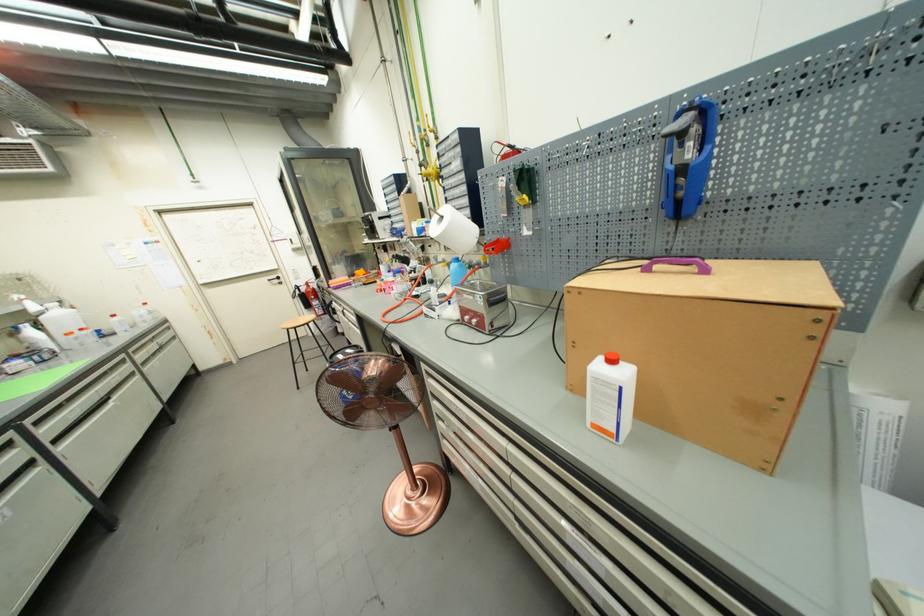
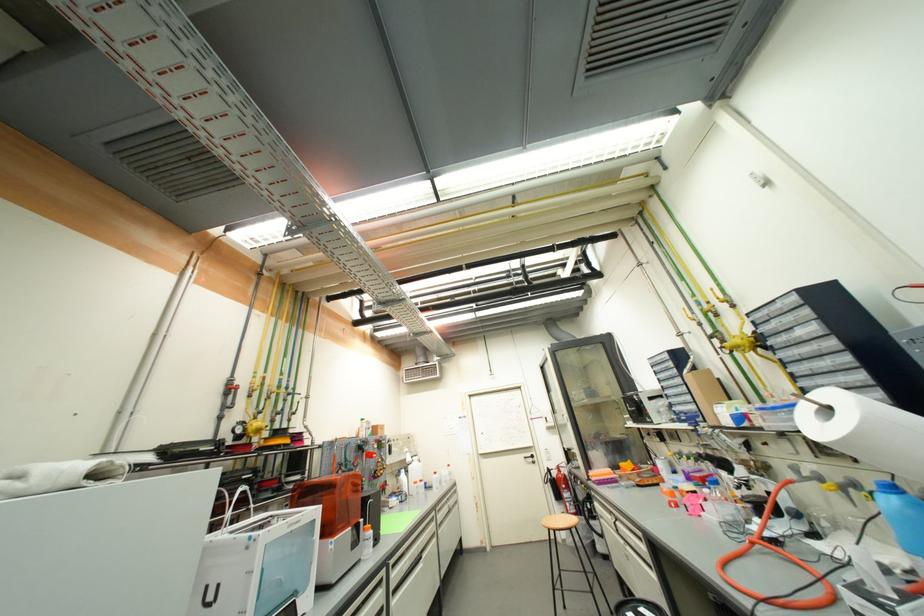
Find the pixel in the second image that matches pixel 458 264 in the first image.

(889, 493)